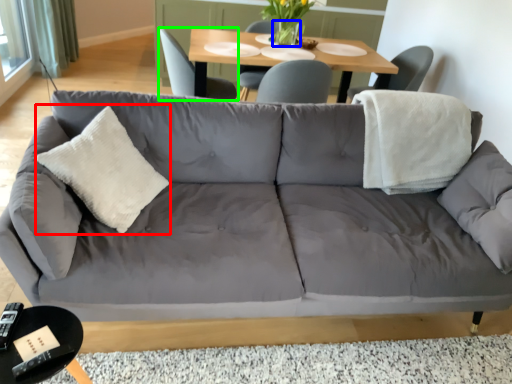
Question: Which object is positioned closest to throw pillow (highlighted by a red box)? Select from vase (highlighted by a blue box) and chair (highlighted by a green box).

Choices:
 (A) vase
 (B) chair

Answer: (B)